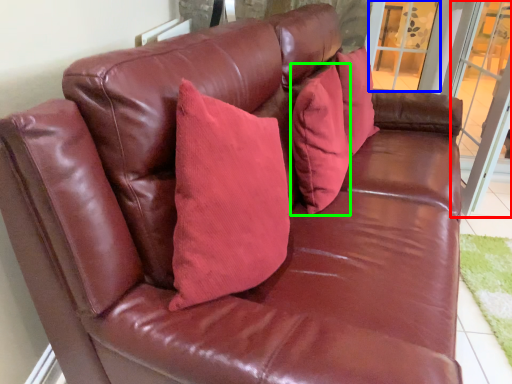
Question: Considering the real-world distances, which object is closest to screen door (highlighted by a red box)? window (highlighted by a blue box) or pillow (highlighted by a green box).

Choices:
 (A) window
 (B) pillow

Answer: (A)